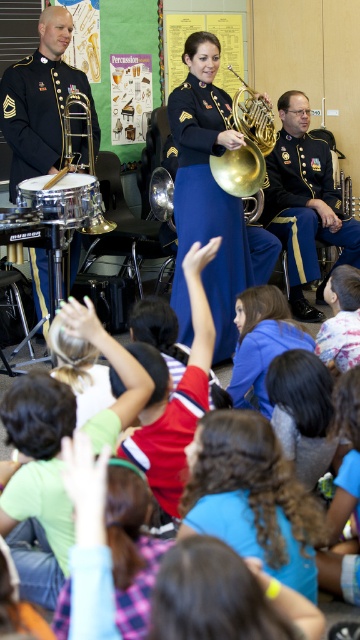
Question: Is red shirt at center to the left of brushed silver drum at left from the viewer's perspective?

Choices:
 (A) yes
 (B) no

Answer: (B)

Question: Which of the following is the closest to the observer?

Choices:
 (A) 167,445
 (B) 23,148
 (C) 245,259
 (D) 262,349

Answer: (A)

Question: Among these points, which one is nearest to the camera?

Choices:
 (A) (69, 115)
 (B) (27, 180)
 (C) (299, 588)
 (D) (195, 330)

Answer: (C)

Question: Does blue fabric shirt at center appear under shiny brass trumpet at left?

Choices:
 (A) no
 (B) yes

Answer: (B)

Question: Which point is farther to the camera?

Choices:
 (A) (227, 424)
 (B) (92, 214)
 (C) (299, 470)

Answer: (B)

Question: Does curly brown hair at center lie in front of blue fabric shirt at center?

Choices:
 (A) yes
 (B) no

Answer: (A)